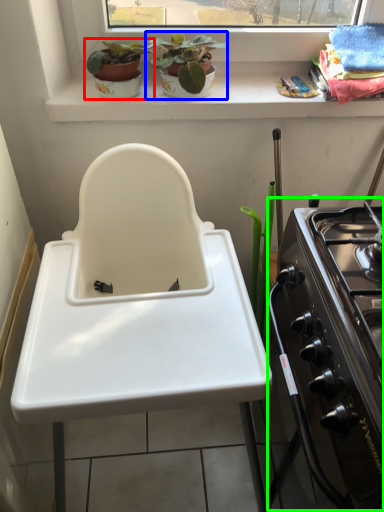
Question: Estimate the real-world distances between objects in this image. Which object is closer to houseplant (highlighted by a red box), houseplant (highlighted by a blue box) or oven (highlighted by a green box)?

Choices:
 (A) houseplant
 (B) oven

Answer: (A)